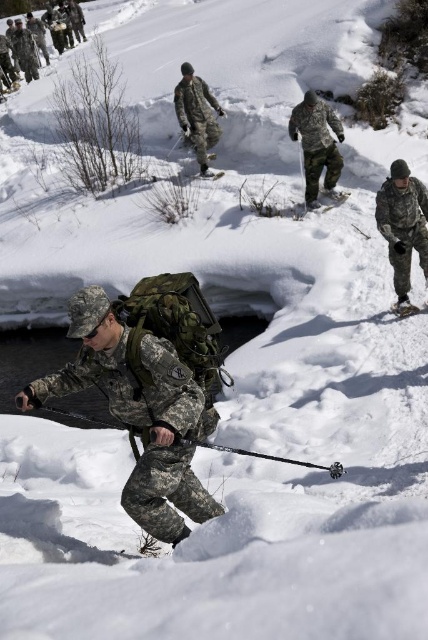
Is point (3, 58) more distant than point (228, 451)?

That is True.

Between camouflage uniform at upper left and matte black ski pole at center, which one has less height?

matte black ski pole at center

This screenshot has width=428, height=640. What are the coordinates of `camouflage uniform at upper left` in the screenshot? It's located at (20, 52).

Who is more forward, (320,113) or (401,300)?

Point (401,300) is more forward.

Find the location of `camouflage fabric pants at center`. camouflage fabric pants at center is located at coordinates (317, 145).

I want to click on matte black ski at center, so click(321, 202).

In the scene shown: Can you confirm if matte black ski at center is positioned below matte black ski at lower right?

Actually, matte black ski at center is above matte black ski at lower right.

Locate an element on the screen. The height and width of the screenshot is (640, 428). matte black ski at center is located at coordinates (321, 202).

This screenshot has width=428, height=640. Find the location of `matte black ski at center`. matte black ski at center is located at coordinates (321, 202).